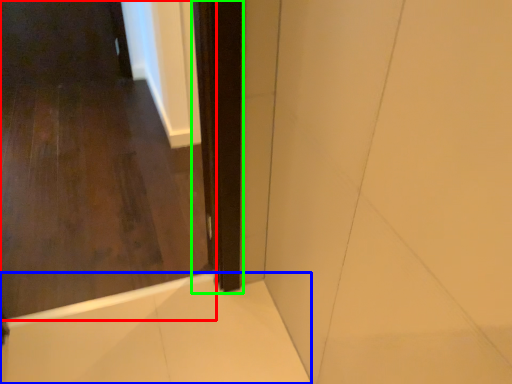
Question: Considering the real-world distances, which object is closest to door (highlighted by a red box)? bath (highlighted by a blue box) or screen door (highlighted by a green box).

Choices:
 (A) bath
 (B) screen door

Answer: (A)